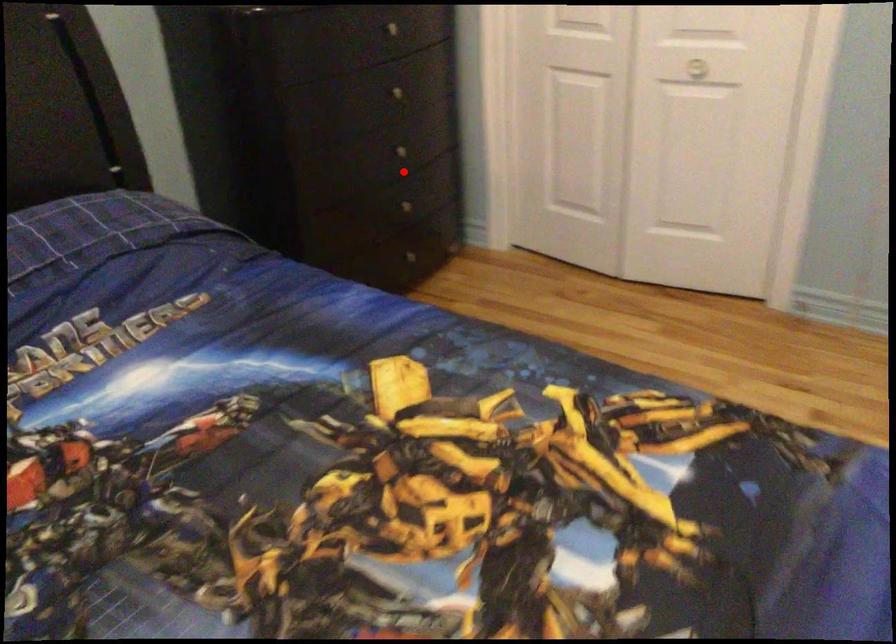
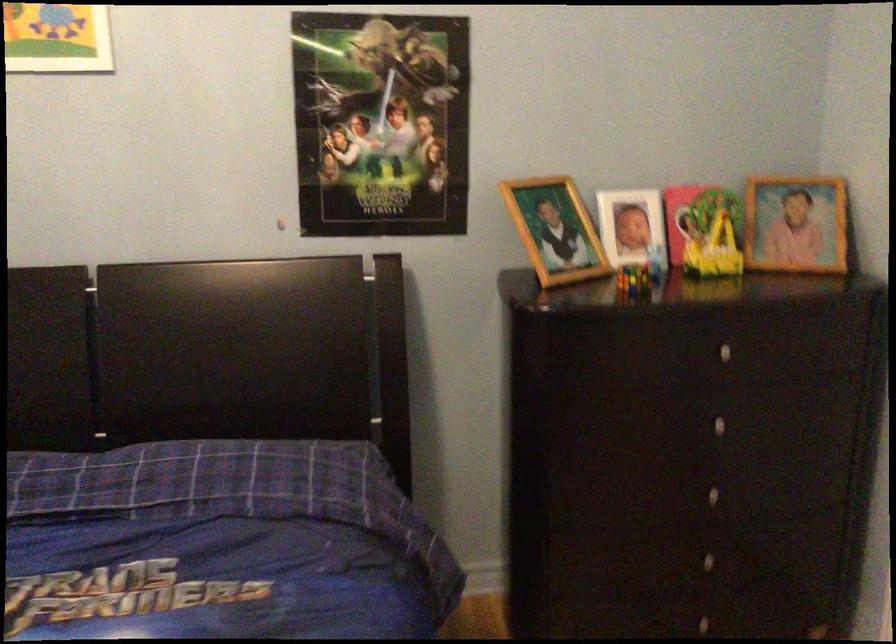
Find the pixel in the second image that matches the highlighted location in the first image.

(711, 516)